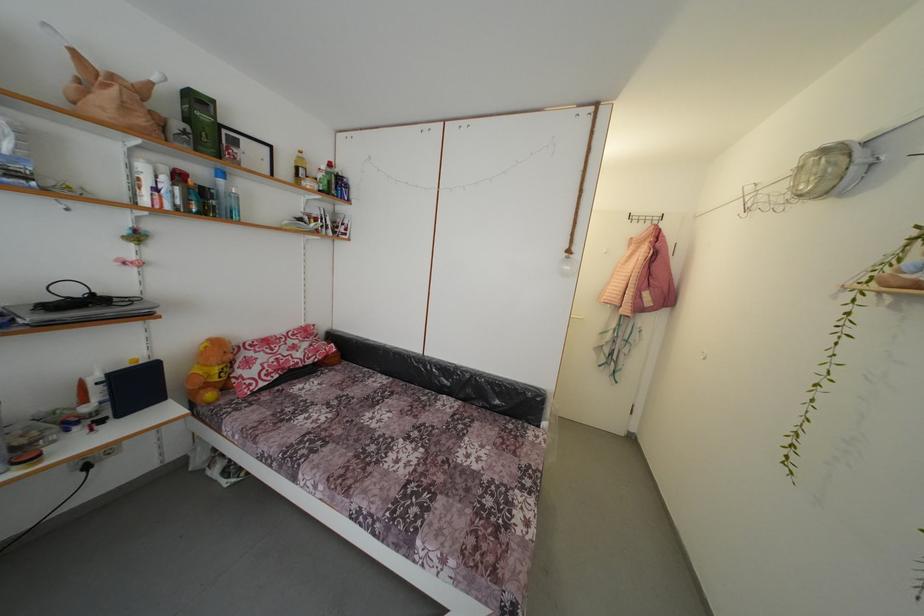
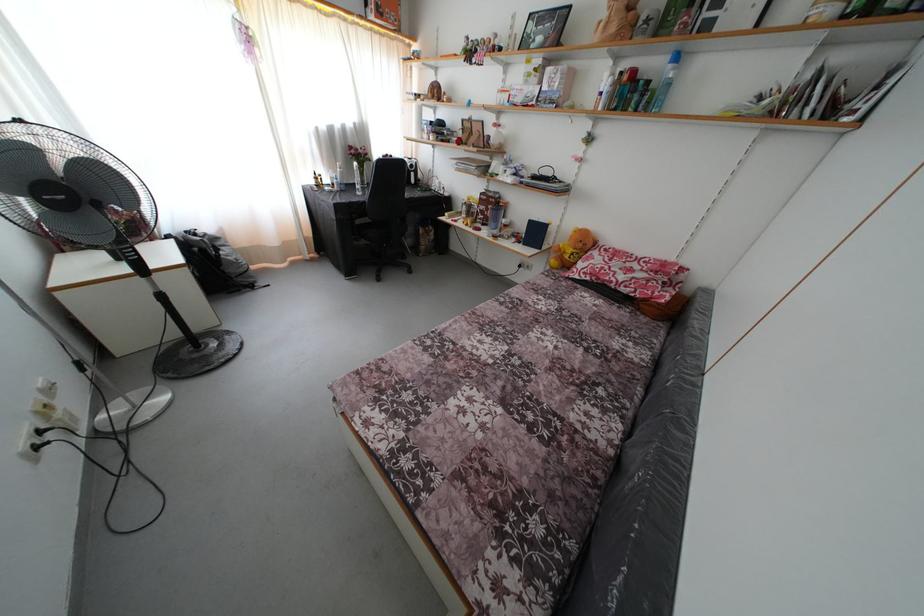
Where in the second image is the point corresponding to pixel 92 472 from the first image?

(525, 272)